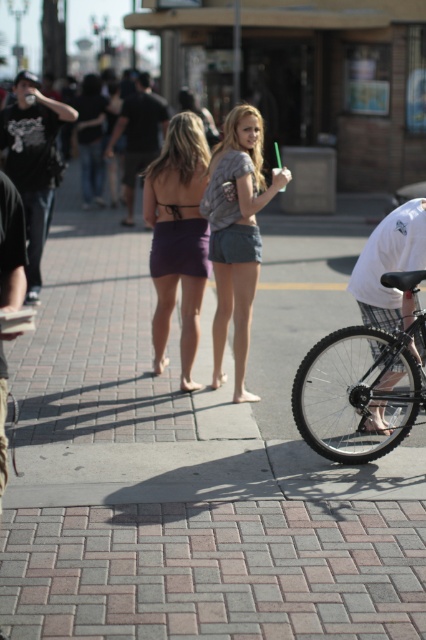
You are standing on the sidewalk in the urban street scene. There are two points marked on the ground. The first point is at coordinates point (0, 141) and the second point is at point (383, 266). If you want to move closer to the first point, which direction should you walk relative to the second point?

To move closer to point (0, 141), you should walk towards the viewer, as it is closer to you than point (383, 266) which is further away.